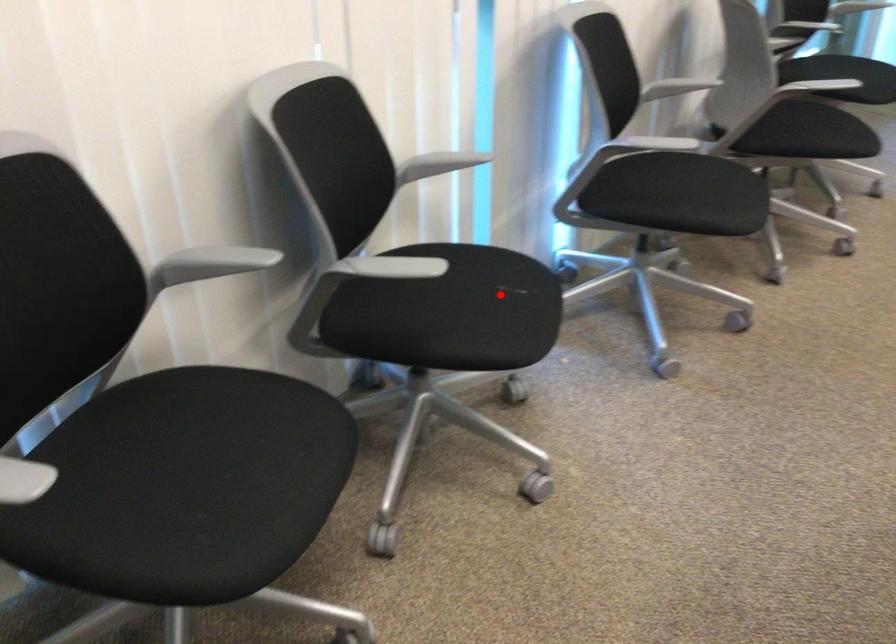
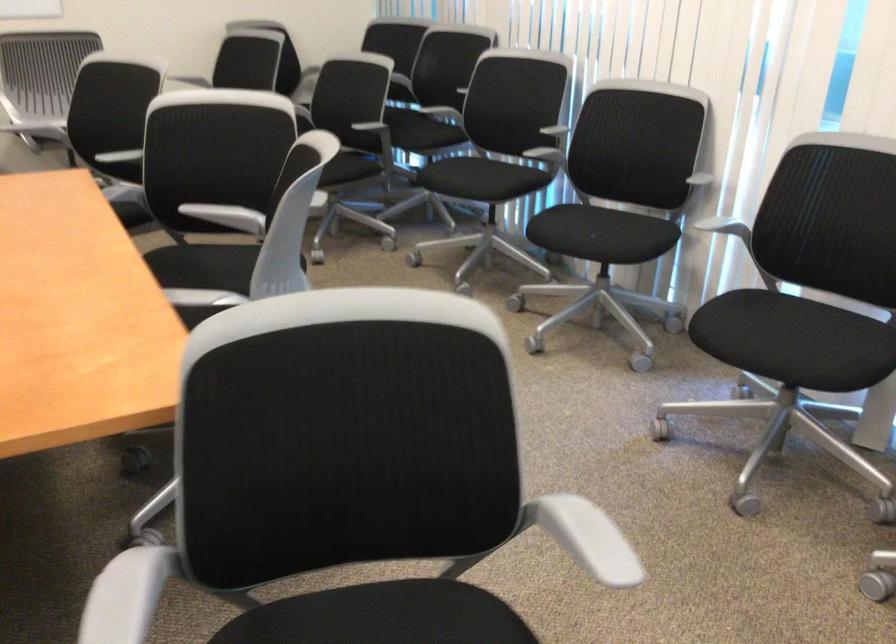
Question: I am providing you with two images of the same scene from different viewpoints. Given a red point in image1, look at the same physical point in image2. Is it:

Choices:
 (A) Closer to the viewpoint
 (B) Farther from the viewpoint

Answer: (B)